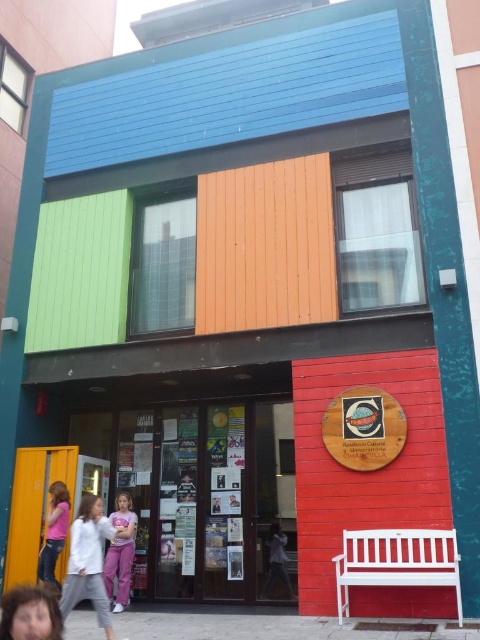
Question: Is glass door at center closer to the viewer compared to pink fabric shirt at lower left?

Choices:
 (A) no
 (B) yes

Answer: (A)

Question: Which of the following is the farthest from the observer?

Choices:
 (A) purple cotton pants at center
 (B) pink fabric shirt at lower left
 (C) light gray fabric shirt at center

Answer: (C)

Question: Is purple cotton pants at center further to camera compared to light gray fabric shirt at center?

Choices:
 (A) no
 (B) yes

Answer: (A)

Question: Which point is farther from the camera taking this photo?

Choices:
 (A) click(274, 579)
 (B) click(60, 604)

Answer: (A)

Question: Can you confirm if glass door at center is positioned above light gray fabric shirt at center?

Choices:
 (A) yes
 (B) no

Answer: (A)

Question: Which of these objects is positioned farthest from the smooth brown hair at lower left?

Choices:
 (A) light purple pants at lower left
 (B) purple cotton pants at center

Answer: (B)